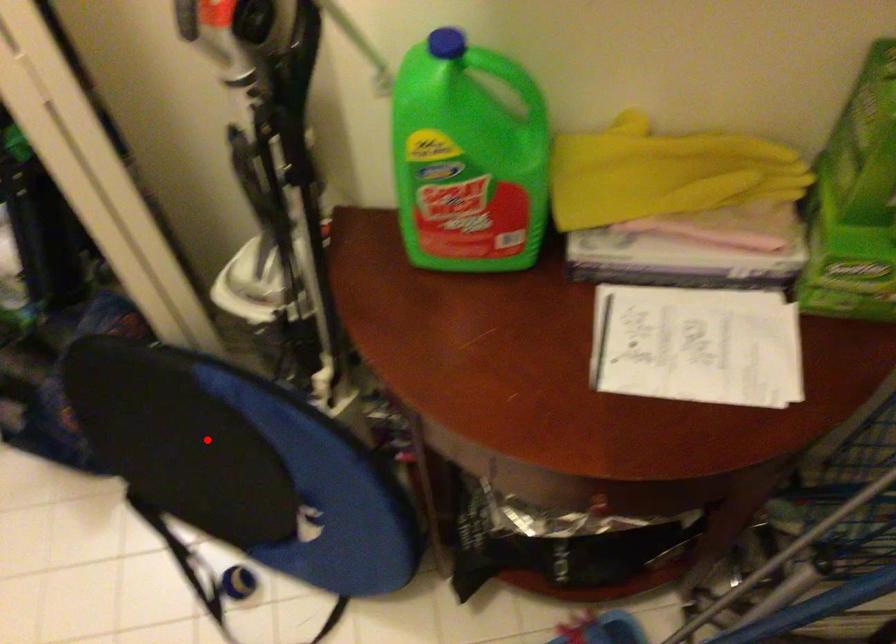
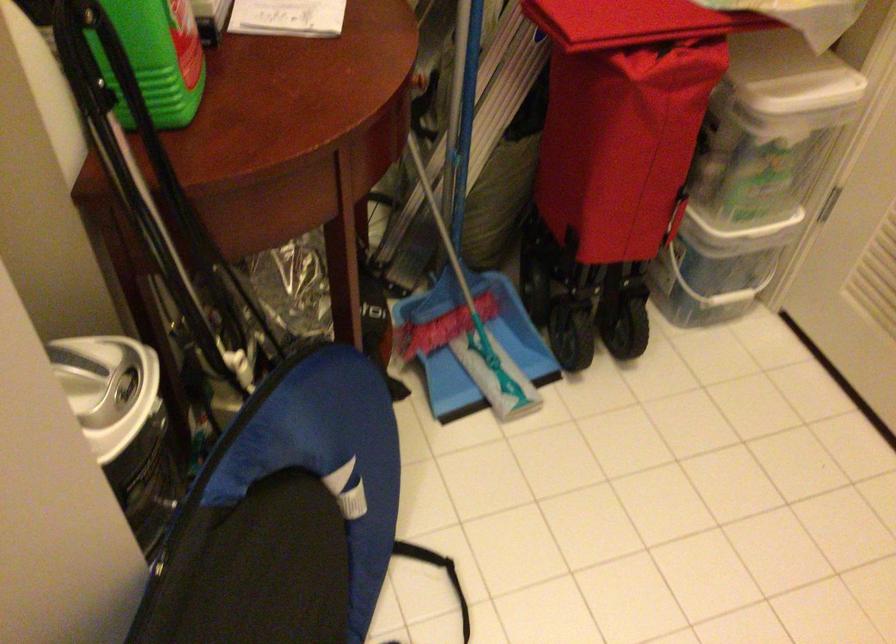
The point at the highlighted location is marked in the first image. Where is the corresponding point in the second image?

(271, 569)